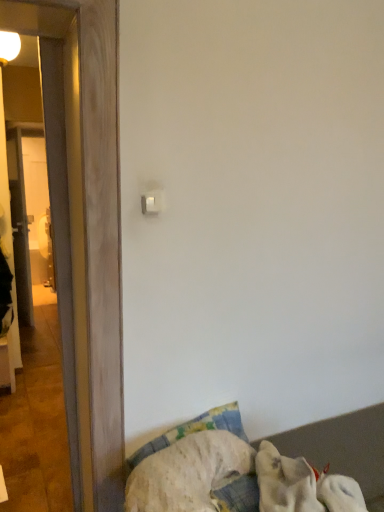
Question: From the image's perspective, does white fabric at lower right appear higher than white plastic light switch at upper center?

Choices:
 (A) no
 (B) yes

Answer: (A)

Question: Is white fabric at lower right closer to the viewer compared to white plastic light switch at upper center?

Choices:
 (A) yes
 (B) no

Answer: (A)

Question: Are white fabric at lower right and white plastic light switch at upper center far apart?

Choices:
 (A) yes
 (B) no

Answer: (A)

Question: Is white fabric at lower right further to camera compared to white plastic light switch at upper center?

Choices:
 (A) no
 (B) yes

Answer: (A)

Question: From a real-world perspective, is white fabric at lower right physically above white plastic light switch at upper center?

Choices:
 (A) no
 (B) yes

Answer: (A)

Question: Can you confirm if white fabric at lower right is positioned to the right of white plastic light switch at upper center?

Choices:
 (A) yes
 (B) no

Answer: (A)

Question: From the image's perspective, would you say white soft dog at lower right is shown under white fabric at lower right?

Choices:
 (A) no
 (B) yes

Answer: (A)

Question: Does white soft dog at lower right have a smaller size compared to white fabric at lower right?

Choices:
 (A) no
 (B) yes

Answer: (B)

Question: Considering the relative positions of white soft dog at lower right and white fabric at lower right in the image provided, is white soft dog at lower right to the right of white fabric at lower right from the viewer's perspective?

Choices:
 (A) no
 (B) yes

Answer: (A)

Question: From a real-world perspective, is white soft dog at lower right below white fabric at lower right?

Choices:
 (A) yes
 (B) no

Answer: (B)

Question: From the image's perspective, is white soft dog at lower right on top of white fabric at lower right?

Choices:
 (A) no
 (B) yes

Answer: (B)

Question: Is white soft dog at lower right surrounding white fabric at lower right?

Choices:
 (A) no
 (B) yes

Answer: (A)

Question: Is white soft dog at lower right not close to wooden door at left?

Choices:
 (A) yes
 (B) no

Answer: (B)